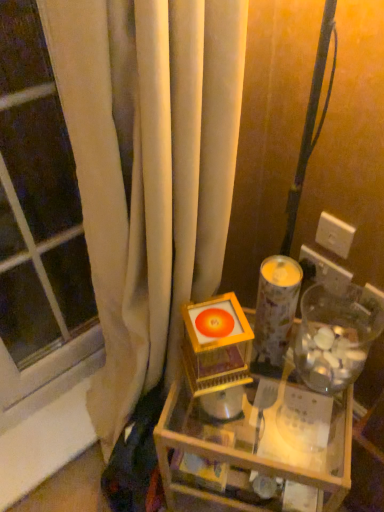
Question: Is transparent plastic jar at right thinner than transparent glass window at left?

Choices:
 (A) no
 (B) yes

Answer: (A)

Question: From the image's perspective, does transparent plastic jar at right appear lower than transparent glass window at left?

Choices:
 (A) no
 (B) yes

Answer: (B)

Question: Is transparent plastic jar at right closer to camera compared to transparent glass window at left?

Choices:
 (A) no
 (B) yes

Answer: (A)

Question: Is transparent plastic jar at right oriented away from transparent glass window at left?

Choices:
 (A) yes
 (B) no

Answer: (B)

Question: Can you confirm if transparent plastic jar at right is shorter than transparent glass window at left?

Choices:
 (A) no
 (B) yes

Answer: (B)

Question: From the image's perspective, would you say transparent plastic jar at right is positioned over transparent glass window at left?

Choices:
 (A) no
 (B) yes

Answer: (A)

Question: Is white plastic electric outlet at upper right, the 2th electric outlet viewed from the top, taller than orange glossy disc at center?

Choices:
 (A) yes
 (B) no

Answer: (B)

Question: From a real-world perspective, is white plastic electric outlet at upper right, the 2th electric outlet viewed from the top, beneath orange glossy disc at center?

Choices:
 (A) yes
 (B) no

Answer: (A)

Question: Is white plastic electric outlet at upper right, the 2th electric outlet viewed from the top, next to orange glossy disc at center?

Choices:
 (A) yes
 (B) no

Answer: (B)

Question: Is white plastic electric outlet at upper right, the first electric outlet in the bottom-to-top sequence, thinner than orange glossy disc at center?

Choices:
 (A) no
 (B) yes

Answer: (B)

Question: Is white plastic electric outlet at upper right, the first electric outlet in the bottom-to-top sequence, further to camera compared to orange glossy disc at center?

Choices:
 (A) no
 (B) yes

Answer: (B)

Question: Is white plastic electric outlet at upper right, the first electric outlet in the bottom-to-top sequence, oriented away from orange glossy disc at center?

Choices:
 (A) no
 (B) yes

Answer: (A)

Question: Is patterned paper candle holder at center bigger than wooden table at center?

Choices:
 (A) yes
 (B) no

Answer: (B)